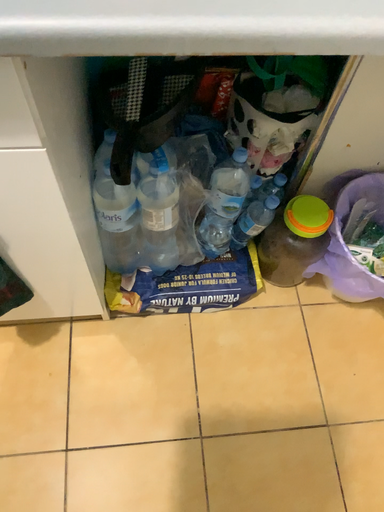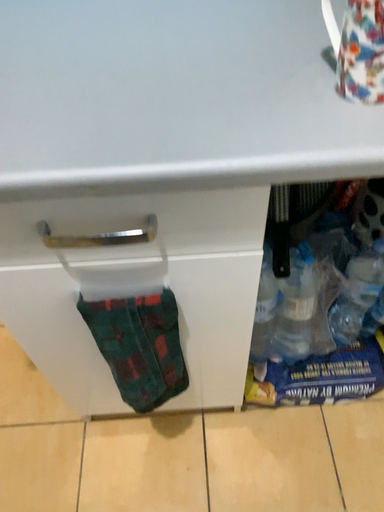
Question: Which way did the camera rotate in the video?

Choices:
 (A) rotated left
 (B) rotated right

Answer: (A)